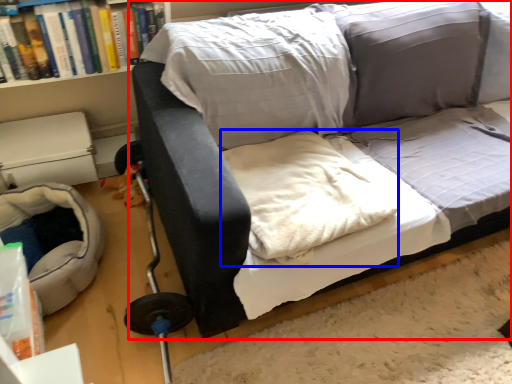
Question: Which object is closer to the camera taking this photo, studio couch (highlighted by a red box) or linen (highlighted by a blue box)?

Choices:
 (A) studio couch
 (B) linen

Answer: (A)